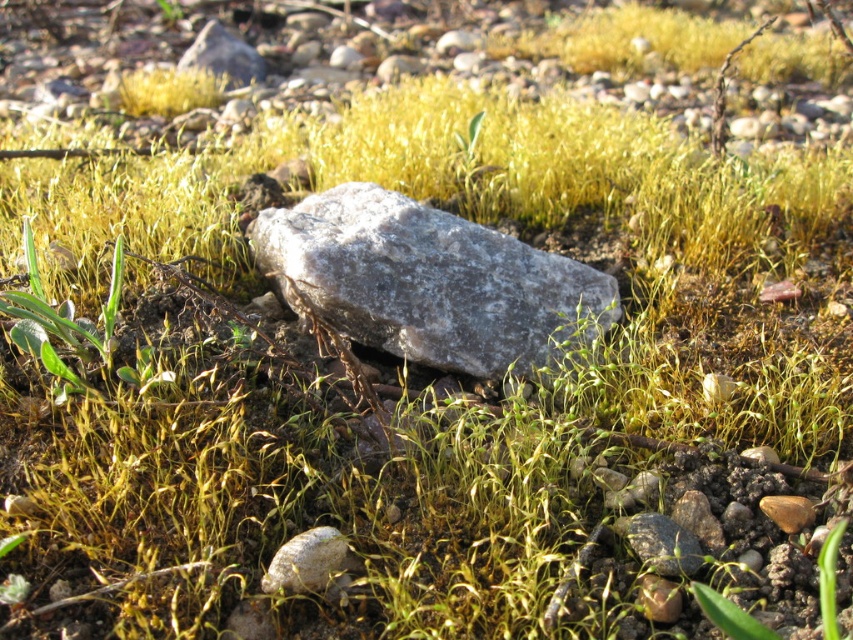
You are a geologist examining the image. You need to locate the gray stone at center. What are its coordinates?

The gray stone at center is located at coordinates point (428, 282).

You are a geologist examining the ground. You see a smooth gray rock at lower center and a gray rock at upper center. Which rock is located to the right of the other?

The smooth gray rock at lower center is positioned on the right side of gray rock at upper center.